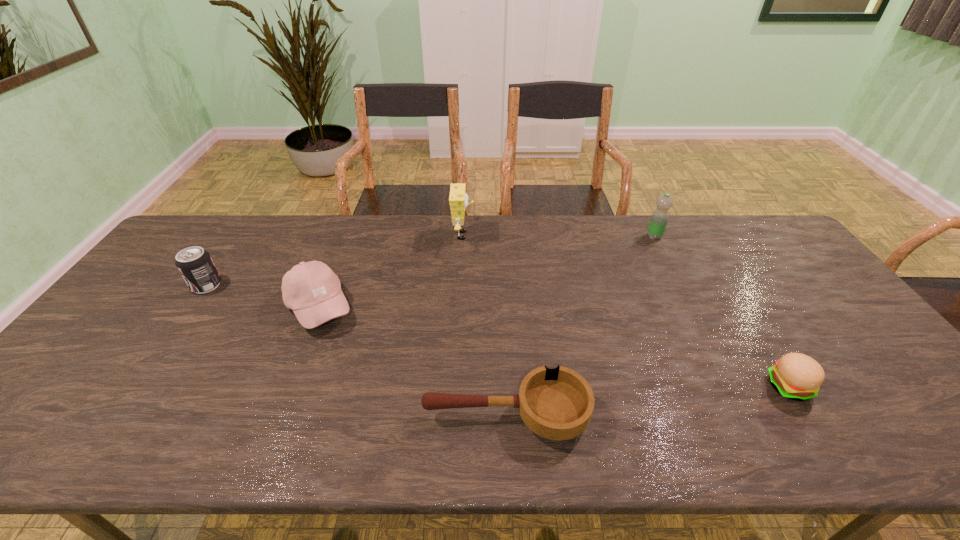
The width and height of the screenshot is (960, 540). What are the coordinates of `vacant space that satisfies the following two spatial constraints: 1. with the handle on the side of the hamburger; 2. on the right side of the saucepan` in the screenshot? It's located at (505, 387).

This screenshot has width=960, height=540. I want to click on vacant space that satisfies the following two spatial constraints: 1. on the back side of the second object from right to left; 2. on the front-facing side of the sponge, so click(x=654, y=235).

At what (x,y) coordinates should I click in order to perform the action: click on free space that satisfies the following two spatial constraints: 1. with the handle on the side of the saucepan; 2. on the right side of the hamburger. Please return your answer as a coordinate pair (x, y). Looking at the image, I should click on (505, 387).

Identify the location of vacant region that satisfies the following two spatial constraints: 1. on the front-facing side of the rightmost object; 2. on the left side of the baseball cap. The image size is (960, 540). 288,387.

Identify the location of vacant space that satisfies the following two spatial constraints: 1. on the front side of the hamburger; 2. on the right side of the leftmost object. (135, 387).

Identify the location of free spot that satisfies the following two spatial constraints: 1. on the front-facing side of the sponge; 2. with the handle on the side of the saucepan. (454, 415).